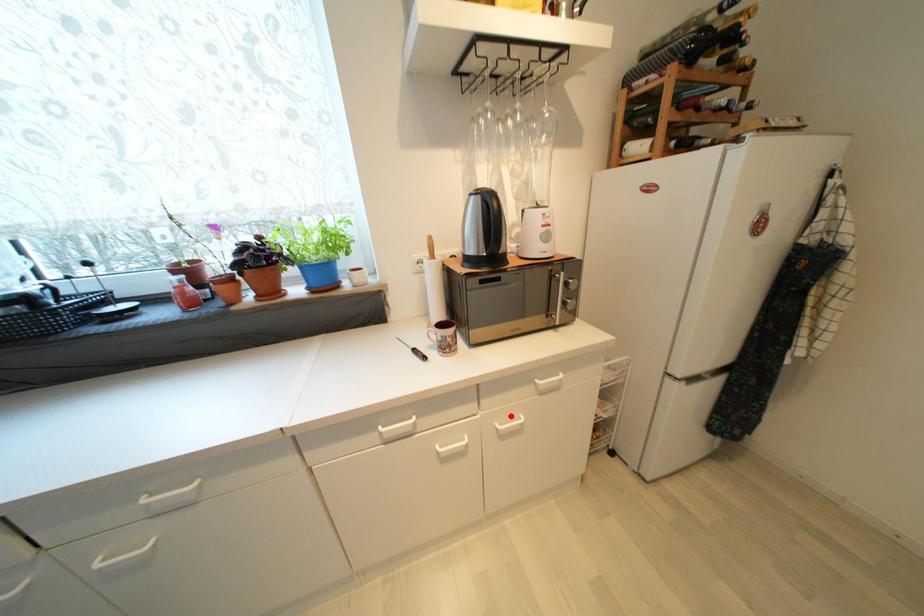
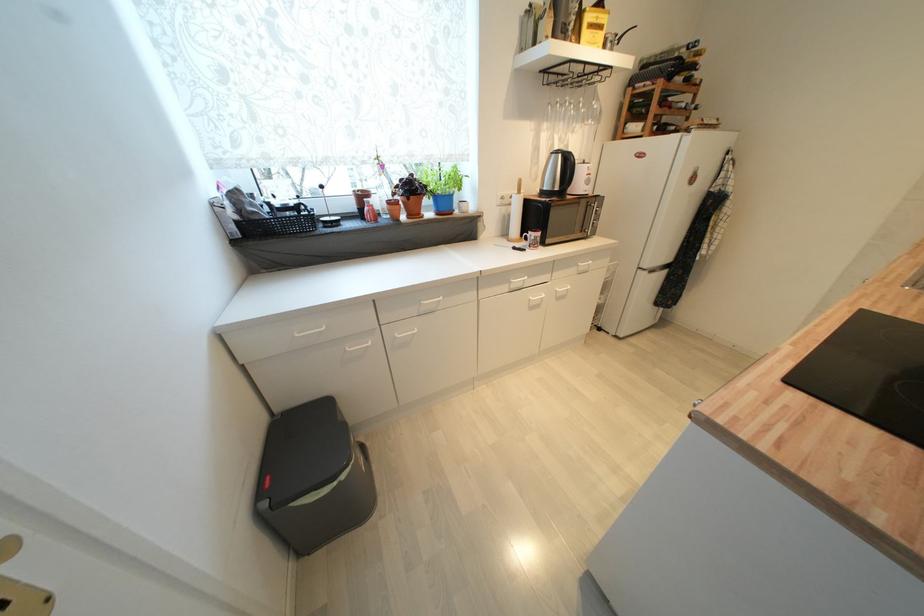
Locate, in the second image, the point that corresponds to the highlighted location in the first image.

(566, 285)